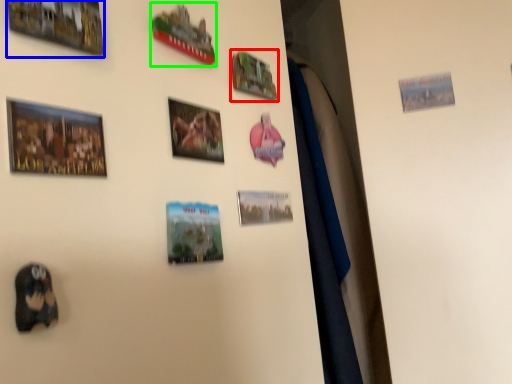
Question: Based on their relative distances, which object is nearer to picture frame (highlighted by a red box)? Choose from picture frame (highlighted by a blue box) and picture frame (highlighted by a green box).

Choices:
 (A) picture frame
 (B) picture frame

Answer: (B)